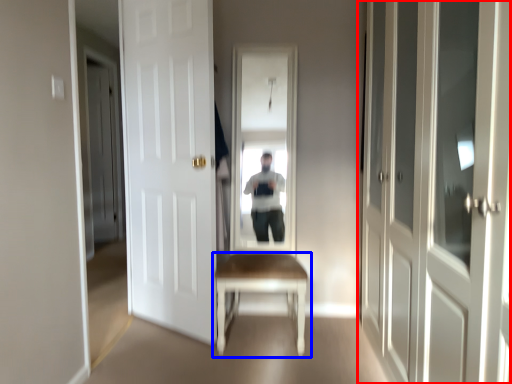
Question: Which object appears farthest to the camera in this image, door (highlighted by a red box) or table (highlighted by a blue box)?

Choices:
 (A) door
 (B) table

Answer: (B)